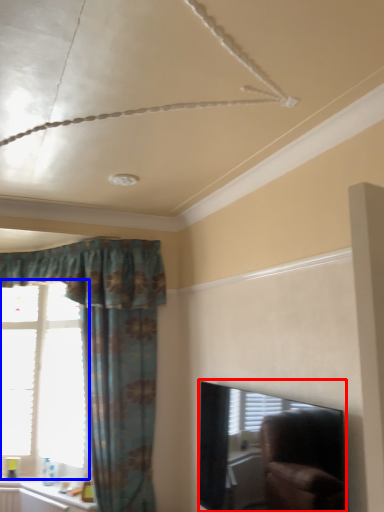
Question: Which object appears closest to the camera in this image, window screen (highlighted by a red box) or window (highlighted by a blue box)?

Choices:
 (A) window screen
 (B) window

Answer: (A)